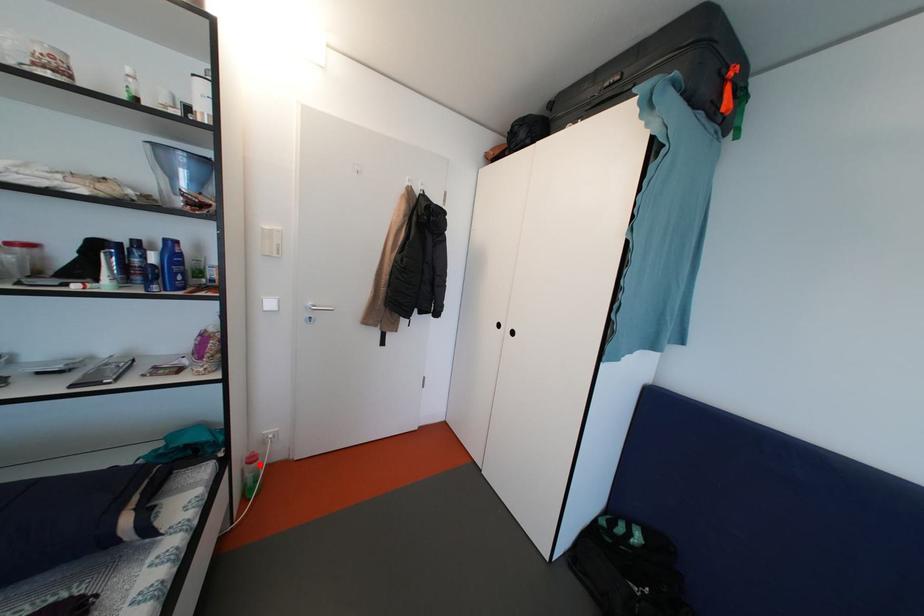
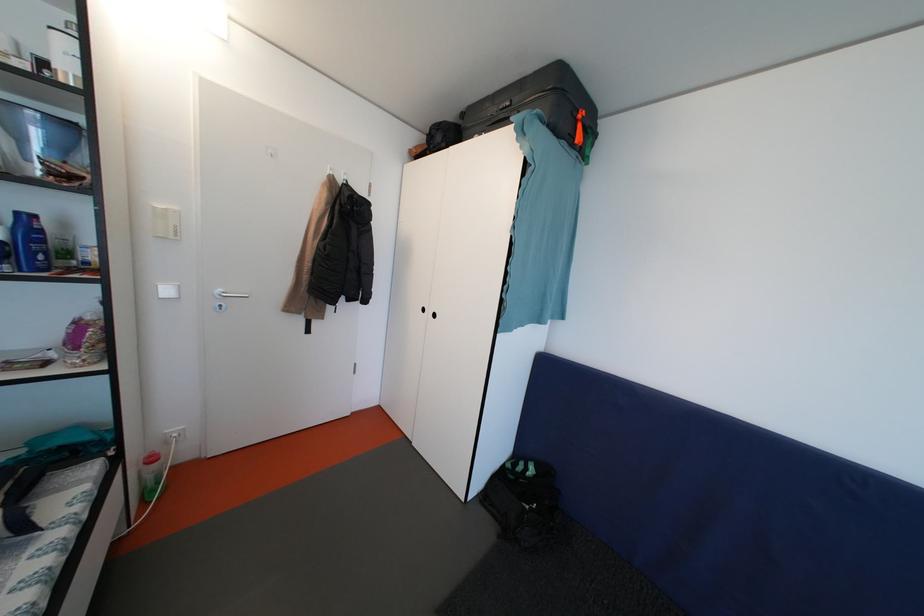
In the second image, find the point that corresponds to the highlighted location in the first image.

(160, 464)